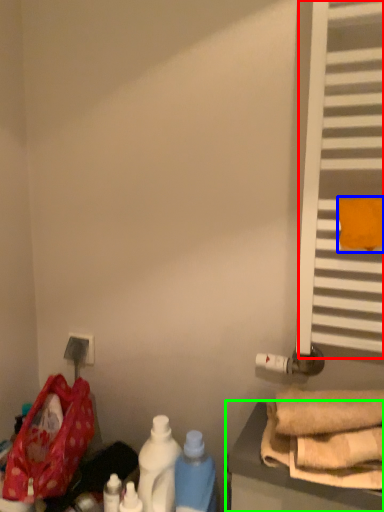
Question: Considering the real-world distances, which object is farthest from window (highlighted by a red box)? beach towel (highlighted by a blue box) or furniture (highlighted by a green box)?

Choices:
 (A) beach towel
 (B) furniture

Answer: (B)